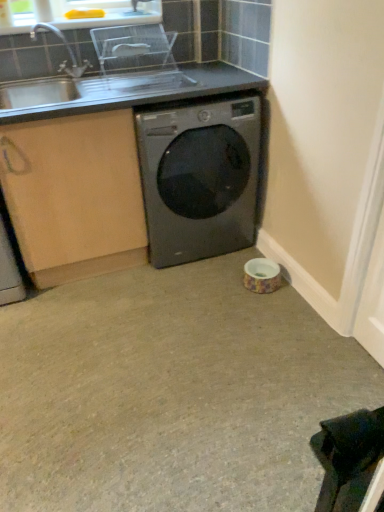
Question: Would you say silver metallic sink at upper left is inside or outside clear plastic dish rack at upper center?

Choices:
 (A) outside
 (B) inside

Answer: (A)

Question: Does point (155, 54) appear closer or farther from the camera than point (127, 82)?

Choices:
 (A) closer
 (B) farther

Answer: (B)

Question: Which is farther from the satin black washing machine at center?

Choices:
 (A) clear plastic dish rack at upper center
 (B) silver metallic sink at upper left
 (C) beige carpet at center

Answer: (B)

Question: Estimate the real-world distances between objects in this image. Which object is farther from the beige carpet at center?

Choices:
 (A) satin black washing machine at center
 (B) silver metallic sink at upper left
 (C) clear plastic dish rack at upper center

Answer: (C)